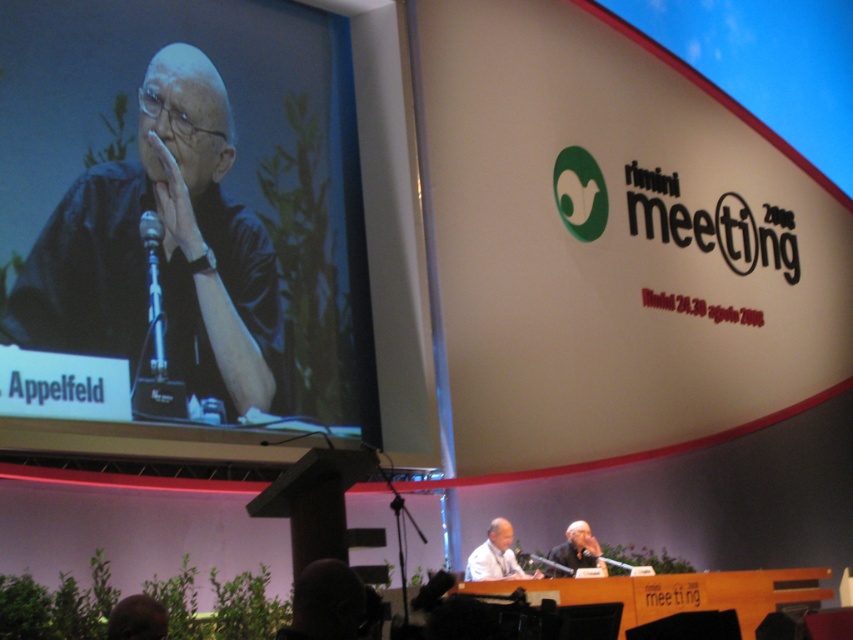
From the picture: Can you confirm if light beige fabric at lower center is smaller than brown hair at lower left?

No.

Is light beige fabric at lower center below brown hair at lower left?

Indeed, light beige fabric at lower center is positioned under brown hair at lower left.

The image size is (853, 640). Find the location of `light beige fabric at lower center`. light beige fabric at lower center is located at coordinates (496, 556).

Locate an element on the screen. light beige fabric at lower center is located at coordinates (496, 556).

Is beige matte projection screen at upper center below black matte/black shirt at upper left?

Incorrect, beige matte projection screen at upper center is not positioned below black matte/black shirt at upper left.

The height and width of the screenshot is (640, 853). Describe the element at coordinates (610, 243) in the screenshot. I see `beige matte projection screen at upper center` at that location.

Identify the location of beige matte projection screen at upper center. pos(610,243).

Is light beige fabric at lower center to the left of smooth skin bald man at center from the viewer's perspective?

Yes, light beige fabric at lower center is to the left of smooth skin bald man at center.

How far apart are light beige fabric at lower center and smooth skin bald man at center?

light beige fabric at lower center and smooth skin bald man at center are 17.71 inches apart from each other.

Locate an element on the screen. light beige fabric at lower center is located at coordinates (496, 556).